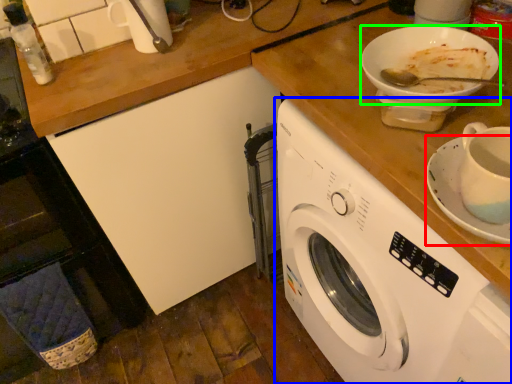
Question: Which is farther away from saucer (highlighted by a red box)? washing machine (highlighted by a blue box) or tableware (highlighted by a green box)?

Choices:
 (A) washing machine
 (B) tableware

Answer: (A)